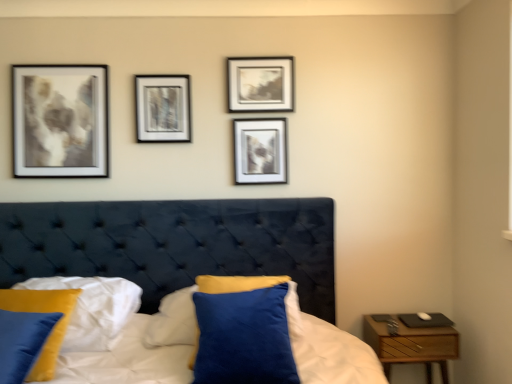
Question: Which direction should I rotate to look at matte black picture frame at upper center, positioned as the 3th picture frame in left-to-right order, — up or down?

Choices:
 (A) up
 (B) down

Answer: (A)

Question: Is wooden nightstand at right to the right of matte silver picture frame at upper center, the 2th picture frame positioned from the right, from the viewer's perspective?

Choices:
 (A) no
 (B) yes

Answer: (B)

Question: From a real-world perspective, is wooden nightstand at right located beneath matte silver picture frame at upper center, marked as the 2th picture frame in a left-to-right arrangement?

Choices:
 (A) yes
 (B) no

Answer: (A)

Question: From the image's perspective, is wooden nightstand at right under matte silver picture frame at upper center, the 2th picture frame positioned from the right?

Choices:
 (A) yes
 (B) no

Answer: (A)

Question: Is wooden nightstand at right facing towards matte silver picture frame at upper center, the 2th picture frame positioned from the right?

Choices:
 (A) no
 (B) yes

Answer: (A)

Question: Is wooden nightstand at right facing away from matte silver picture frame at upper center, marked as the 2th picture frame in a left-to-right arrangement?

Choices:
 (A) no
 (B) yes

Answer: (A)

Question: Is wooden nightstand at right not within matte silver picture frame at upper center, marked as the 2th picture frame in a left-to-right arrangement?

Choices:
 (A) yes
 (B) no

Answer: (A)

Question: Is matte black picture frame at upper center, positioned as the 3th picture frame in left-to-right order, surrounded by metallic silver frame at center, the first picture frame when ordered from left to right?

Choices:
 (A) no
 (B) yes

Answer: (A)

Question: Is metallic silver frame at center, the first picture frame when ordered from left to right, touching matte black picture frame at upper center, positioned as the 3th picture frame in left-to-right order?

Choices:
 (A) no
 (B) yes

Answer: (A)

Question: Does metallic silver frame at center, the 3th picture frame in the right-to-left sequence, have a lesser height compared to matte black picture frame at upper center, positioned as the 3th picture frame in left-to-right order?

Choices:
 (A) yes
 (B) no

Answer: (B)

Question: Does metallic silver frame at center, the 3th picture frame in the right-to-left sequence, have a greater width compared to matte black picture frame at upper center, which is the 1th picture frame in right-to-left order?

Choices:
 (A) yes
 (B) no

Answer: (B)

Question: Would you say metallic silver frame at center, the 3th picture frame in the right-to-left sequence, is outside matte black picture frame at upper center, positioned as the 3th picture frame in left-to-right order?

Choices:
 (A) yes
 (B) no

Answer: (A)

Question: Is metallic silver frame at center, the first picture frame when ordered from left to right, oriented towards matte black picture frame at upper center, positioned as the 3th picture frame in left-to-right order?

Choices:
 (A) no
 (B) yes

Answer: (A)

Question: Is velvet blue pillow at lower left, which appears as the 2th pillow when viewed from the right, behind matte black picture frame at upper center, which is the 1th picture frame in right-to-left order?

Choices:
 (A) no
 (B) yes

Answer: (A)